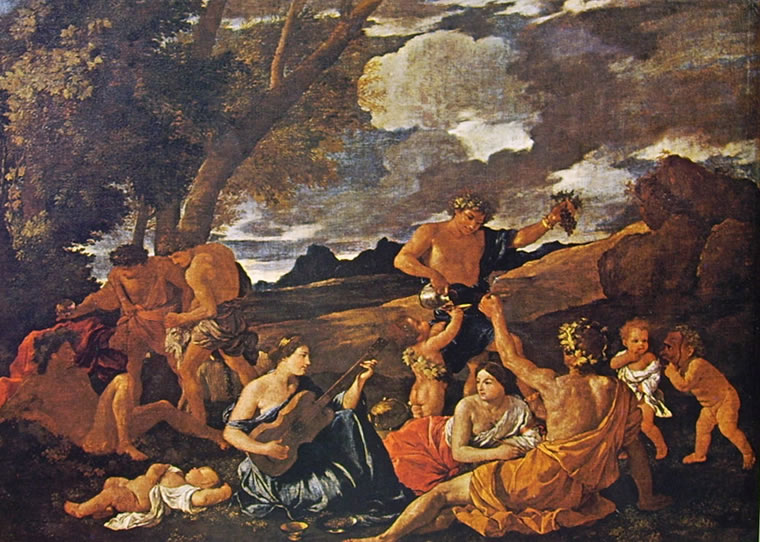
Find the location of a particular element. glass is located at coordinates (65, 306).